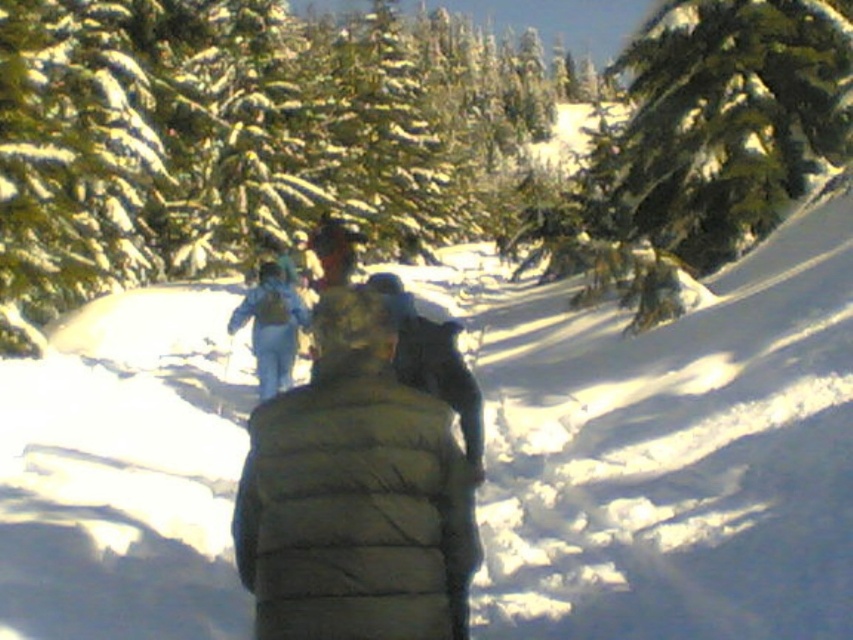
Measure the distance from green textured pine tree at upper right to green puffy jacket at center.

The distance of green textured pine tree at upper right from green puffy jacket at center is 16.88 meters.

Is green textured pine tree at upper right above green puffy jacket at center?

Indeed, green textured pine tree at upper right is positioned over green puffy jacket at center.

The height and width of the screenshot is (640, 853). What do you see at coordinates (705, 145) in the screenshot?
I see `green textured pine tree at upper right` at bounding box center [705, 145].

Locate an element on the screen. green textured pine tree at upper right is located at coordinates (705, 145).

Between point (221, 182) and point (837, 134), which one is positioned in front?

Positioned in front is point (837, 134).

Can you confirm if green textured pine tree at center is positioned below green textured pine tree at upper right?

No.

Between point (218, 49) and point (784, 145), which one is positioned in front?

Positioned in front is point (784, 145).

Locate an element on the screen. The image size is (853, 640). green textured pine tree at center is located at coordinates (247, 134).

Is green textured pine tree at center to the left of green puffy jacket at center from the viewer's perspective?

Indeed, green textured pine tree at center is positioned on the left side of green puffy jacket at center.

The width and height of the screenshot is (853, 640). What do you see at coordinates (247, 134) in the screenshot?
I see `green textured pine tree at center` at bounding box center [247, 134].

Find the location of a particular element. This screenshot has width=853, height=640. green textured pine tree at center is located at coordinates (247, 134).